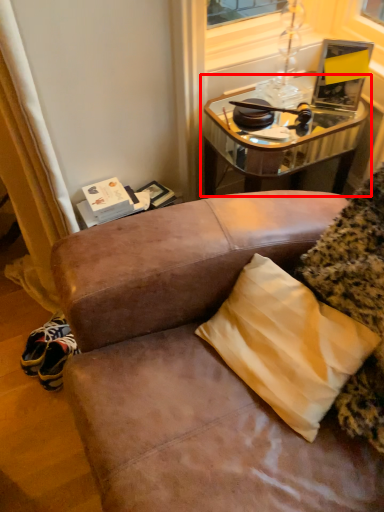
Question: Considering the relative positions of table (annotated by the red box) and pillow in the image provided, where is table (annotated by the red box) located with respect to the staircase?

Choices:
 (A) right
 (B) left

Answer: (A)